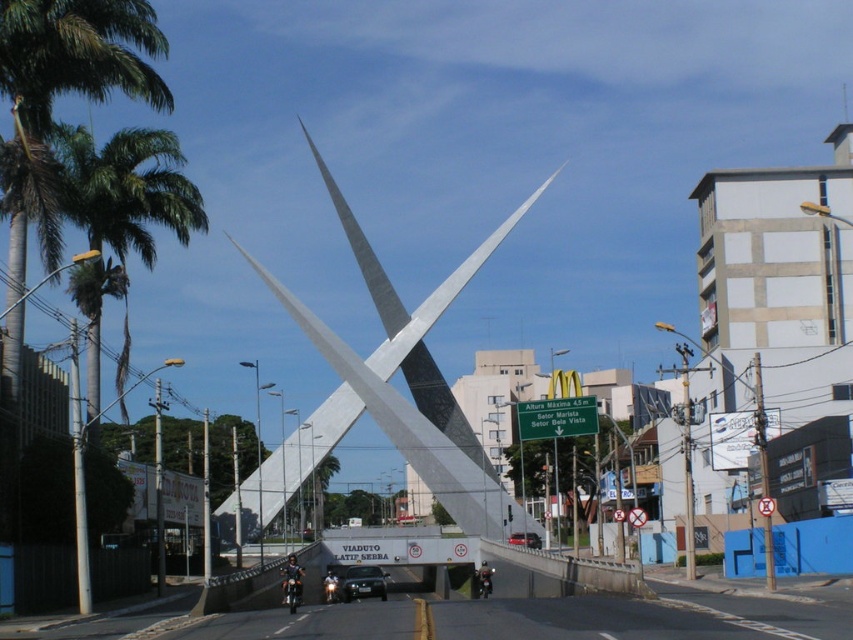
Is silver polished steel sculpture at center bigger than metallic silver car at center?

Yes, silver polished steel sculpture at center is bigger than metallic silver car at center.

Which is more to the right, silver polished steel sculpture at center or metallic silver car at center?

metallic silver car at center

Does point (430, 404) lie behind point (527, 544)?

Yes, point (430, 404) is farther from viewer.

You are a GUI agent. You are given a task and a screenshot of the screen. Output one action in this format:
    pyautogui.click(x=<x>, y=<y>)
    Task: Click on the silver polished steel sculpture at center
    This screenshot has width=853, height=640.
    Given the screenshot: What is the action you would take?
    click(x=410, y=381)

Between silver polished steel sculpture at center and black metallic car at center, which one is positioned higher?

Positioned higher is silver polished steel sculpture at center.

Between silver polished steel sculpture at center and black metallic car at center, which one appears on the right side from the viewer's perspective?

From the viewer's perspective, black metallic car at center appears more on the right side.

Image resolution: width=853 pixels, height=640 pixels. I want to click on silver polished steel sculpture at center, so click(410, 381).

Image resolution: width=853 pixels, height=640 pixels. I want to click on silver polished steel sculpture at center, so click(x=410, y=381).

The image size is (853, 640). What do you see at coordinates (363, 582) in the screenshot?
I see `black metallic car at center` at bounding box center [363, 582].

Measure the distance between black metallic car at center and camera.

black metallic car at center is 107.68 meters from camera.

Who is more forward, (370, 577) or (521, 536)?

Positioned in front is point (370, 577).

Where is `black metallic car at center`? This screenshot has height=640, width=853. black metallic car at center is located at coordinates (363, 582).